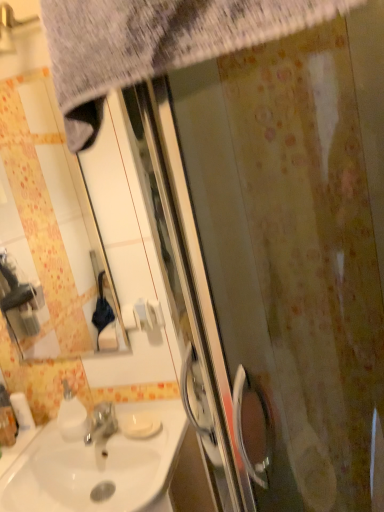
You are a GUI agent. You are given a task and a screenshot of the screen. Output one action in this format:
    pyautogui.click(x=<x>, y=<y>)
    Task: Click on the free location in front of white matte toilet paper at lower left
    The image size is (384, 512).
    Given the screenshot: What is the action you would take?
    click(23, 456)